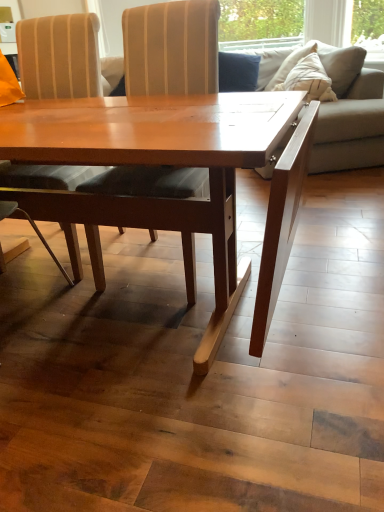
At what (x,y) coordinates should I click in order to perform the action: click on free space between wooden striped chair at center, which appears as the 2th chair when viewed from the left, and matte wood chair at center, which appears as the first chair when viewed from the left. Please return your answer as a coordinate pair (x, y). This screenshot has height=512, width=384. Looking at the image, I should click on (108, 262).